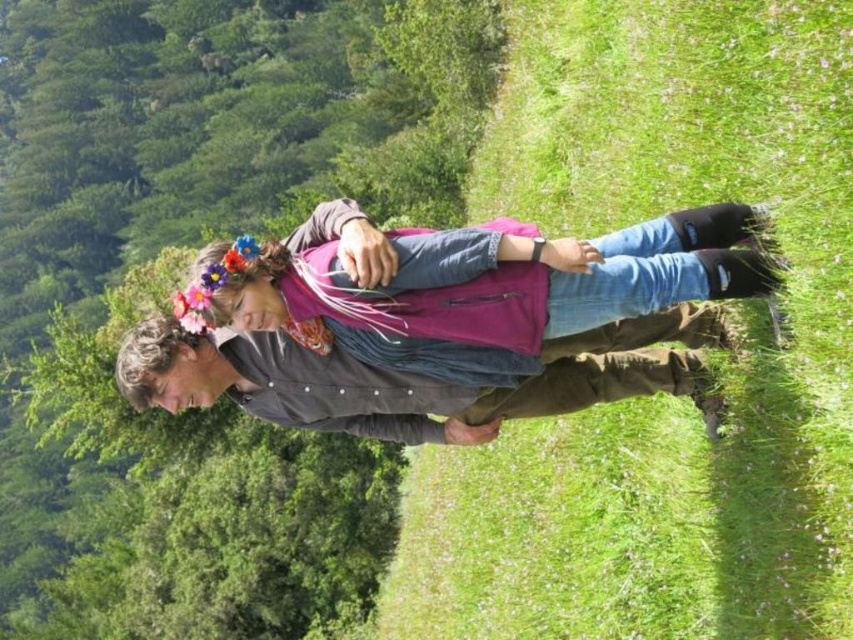
Based on the scene description, where is the point at coordinates (x=660, y=396) located?

The point at coordinates (x=660, y=396) is located on the green grassy field at center.

You are planning to set up a picnic blanket in the green grassy field at center. However, you also have a denim jacket at center that you want to place on the ground. Which object has a smaller width to fit within a 1 meter space?

The green grassy field at center is thinner than the denim jacket at center, so the green grassy field at center has a smaller width and can fit within a 1 meter space better.